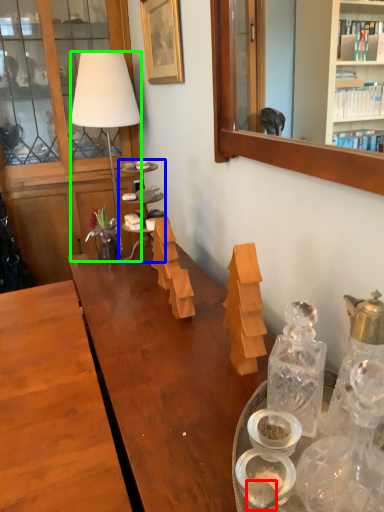
Question: Considering the real-world distances, which object is farthest from food (highlighted by a red box)? shelf (highlighted by a blue box) or lamp (highlighted by a green box)?

Choices:
 (A) shelf
 (B) lamp

Answer: (B)